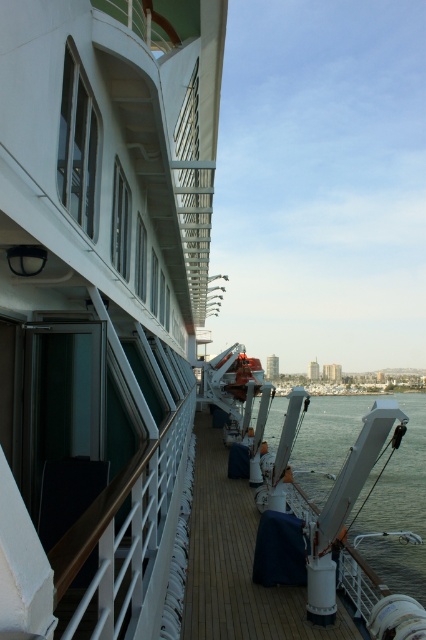
Question: Does matte white deck at center have a greater width compared to white glossy water at center?

Choices:
 (A) no
 (B) yes

Answer: (A)

Question: In this image, where is matte white deck at center located relative to white glossy water at center?

Choices:
 (A) right
 (B) left

Answer: (B)

Question: Which of the following is the farthest from the observer?

Choices:
 (A) white glossy water at center
 (B) matte white deck at center

Answer: (A)

Question: Does matte white deck at center appear over white glossy water at center?

Choices:
 (A) no
 (B) yes

Answer: (B)

Question: Which object is farther from the camera taking this photo?

Choices:
 (A) white glossy water at center
 (B) matte white deck at center

Answer: (A)